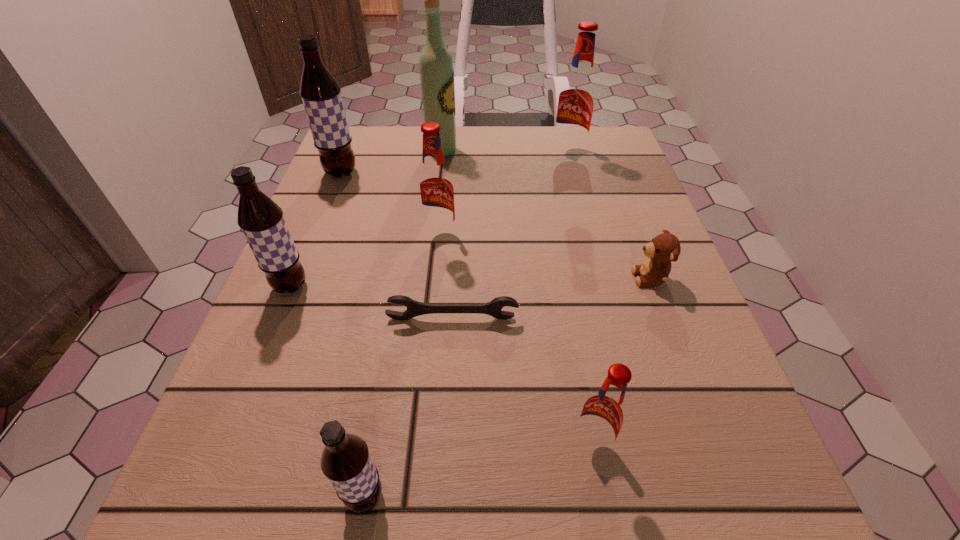
Find the location of `the nearest red root beer`. the nearest red root beer is located at coordinates (603, 415).

Locate an element on the screen. The width and height of the screenshot is (960, 540). the nearest root beer is located at coordinates [346, 462].

This screenshot has height=540, width=960. I want to click on the third root beer from left to right, so click(346, 462).

In order to click on the second shortest object in this screenshot , I will do `click(663, 249)`.

Identify the location of teddy bear. (663, 249).

Identify the location of wrench. (414, 308).

Where is `the third nearest object`? the third nearest object is located at coordinates (414, 308).

I want to click on vacant region located on the front-facing side of the white wine bottle, so click(548, 151).

Locate an element on the screen. The height and width of the screenshot is (540, 960). free region located 0.130m on the front of the rightmost root beer is located at coordinates (579, 194).

Locate an element on the screen. This screenshot has width=960, height=540. free space located on the front of the biggest brown root beer is located at coordinates (287, 309).